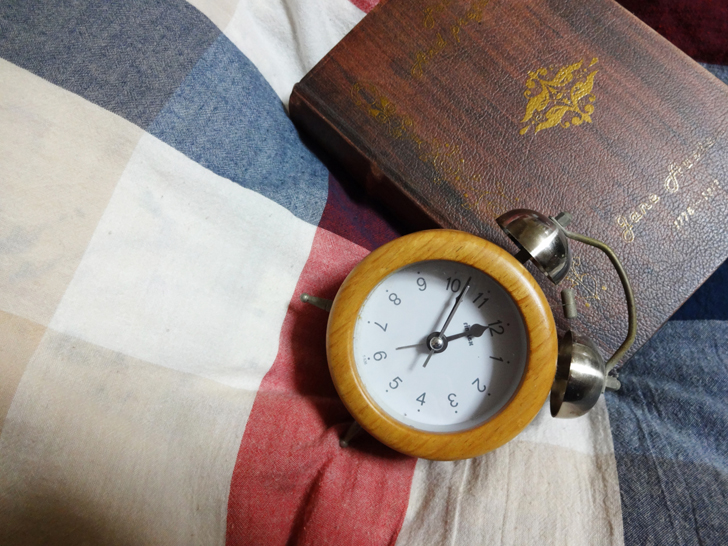
Identify the location of book. (486, 148).